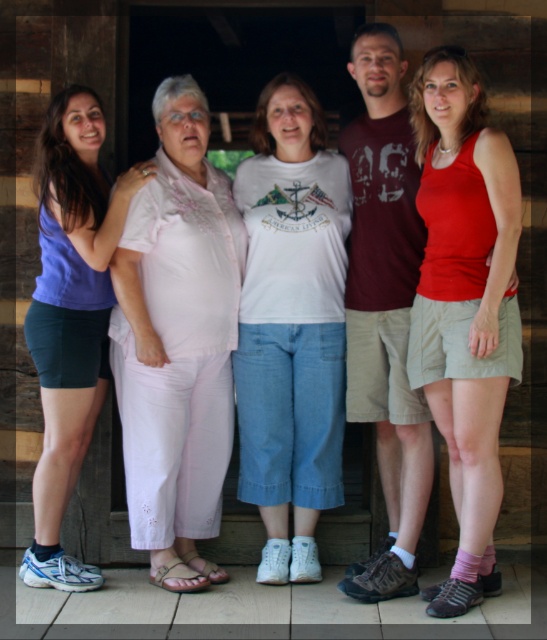
Which is above, white cotton t-shirt at center or red matte tank top at center?

red matte tank top at center

Can you confirm if white cotton t-shirt at center is positioned to the left of red matte tank top at center?

Yes, white cotton t-shirt at center is to the left of red matte tank top at center.

Is point (333, 374) more distant than point (440, 344)?

Yes, point (333, 374) is behind point (440, 344).

This screenshot has width=547, height=640. I want to click on white cotton t-shirt at center, so click(292, 326).

Is red matte tank top at center above matte purple tank top at left?

Yes, red matte tank top at center is above matte purple tank top at left.

Identify the location of red matte tank top at center. The width and height of the screenshot is (547, 640). (464, 305).

Which is in front, point (316, 257) or point (54, 310)?

Point (54, 310)

Is point (318, 136) behind point (40, 584)?

Yes, point (318, 136) is farther from viewer.

I want to click on white cotton t-shirt at center, so click(292, 326).